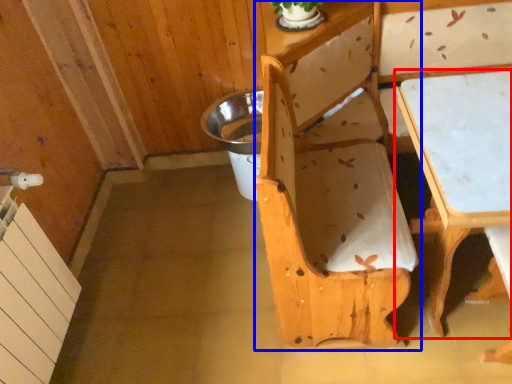
Question: Which object appears closest to the camera in this image, table (highlighted by a red box) or chair (highlighted by a blue box)?

Choices:
 (A) table
 (B) chair

Answer: (B)